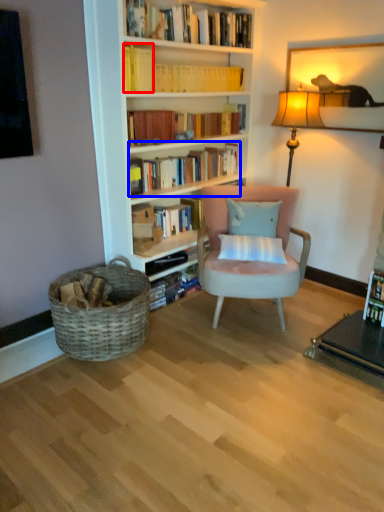
Question: Which of the following is the closest to the observer, book (highlighted by a red box) or book (highlighted by a blue box)?

Choices:
 (A) book
 (B) book

Answer: (A)